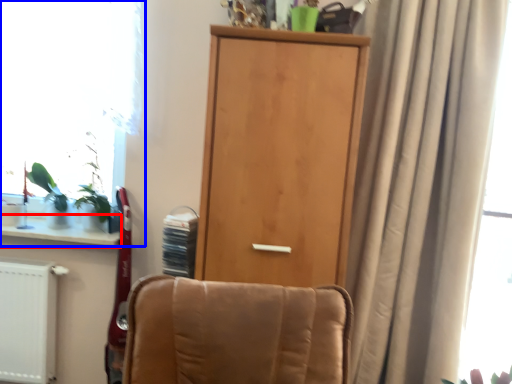
Question: Which object appears farthest to the camera in this image, window sill (highlighted by a red box) or window (highlighted by a blue box)?

Choices:
 (A) window sill
 (B) window

Answer: (B)